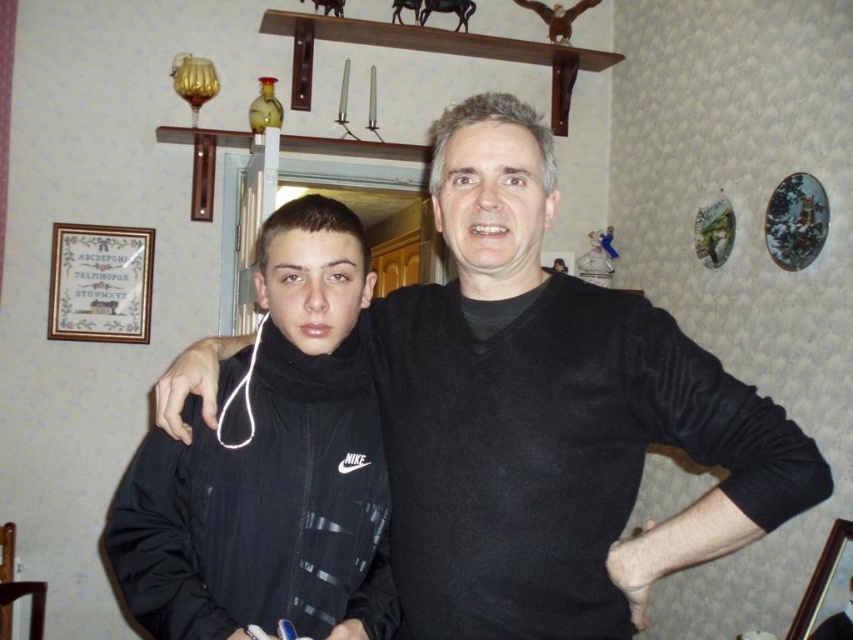
Question: Is black matte sweater at center bigger than black matte jacket at center?

Choices:
 (A) no
 (B) yes

Answer: (B)

Question: Is the position of black matte sweater at center more distant than that of black matte jacket at center?

Choices:
 (A) no
 (B) yes

Answer: (A)

Question: Which of the following is the closest to the observer?

Choices:
 (A) (148, 595)
 (B) (483, 125)

Answer: (A)

Question: Which point is closer to the camera?

Choices:
 (A) black matte jacket at center
 (B) black matte sweater at center

Answer: (B)

Question: Does black matte sweater at center have a larger size compared to black matte jacket at center?

Choices:
 (A) yes
 (B) no

Answer: (A)